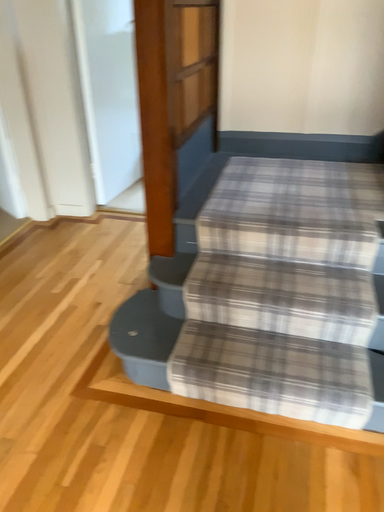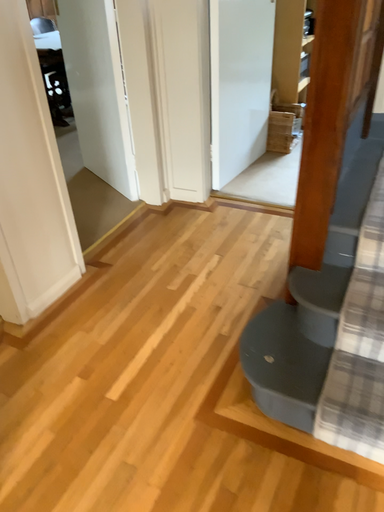
Question: How did the camera likely rotate when shooting the video?

Choices:
 (A) rotated left
 (B) rotated right

Answer: (A)